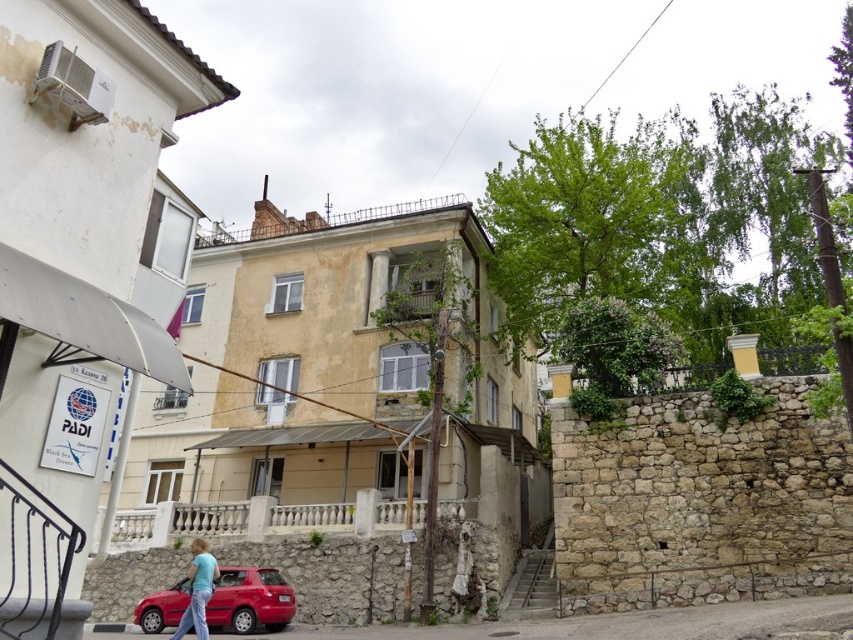
Who is positioned more to the left, shiny red car at lower left or blue cotton shirt at lower center?

blue cotton shirt at lower center

Who is taller, shiny red car at lower left or blue cotton shirt at lower center?

shiny red car at lower left

Between point (239, 630) and point (195, 570), which one is positioned in front?

Point (195, 570) is more forward.

The width and height of the screenshot is (853, 640). I want to click on shiny red car at lower left, so click(x=250, y=600).